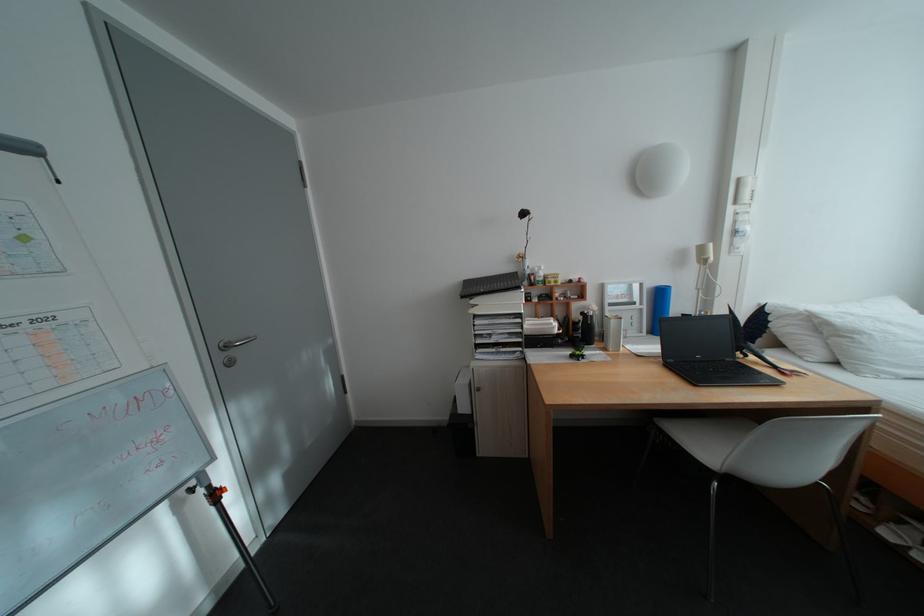
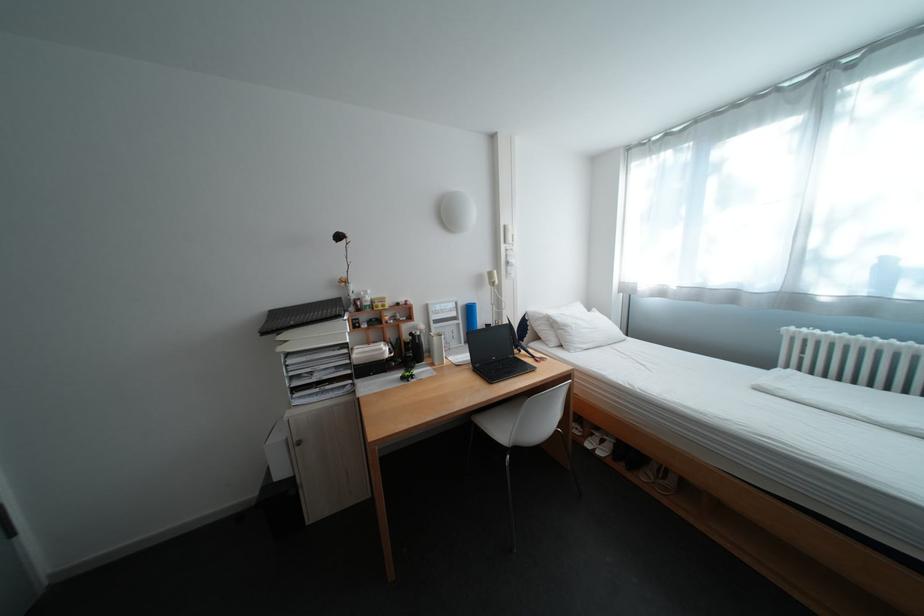
Question: How did the camera likely rotate?

Choices:
 (A) Left
 (B) Right
 (C) Up
 (D) Down

Answer: (B)